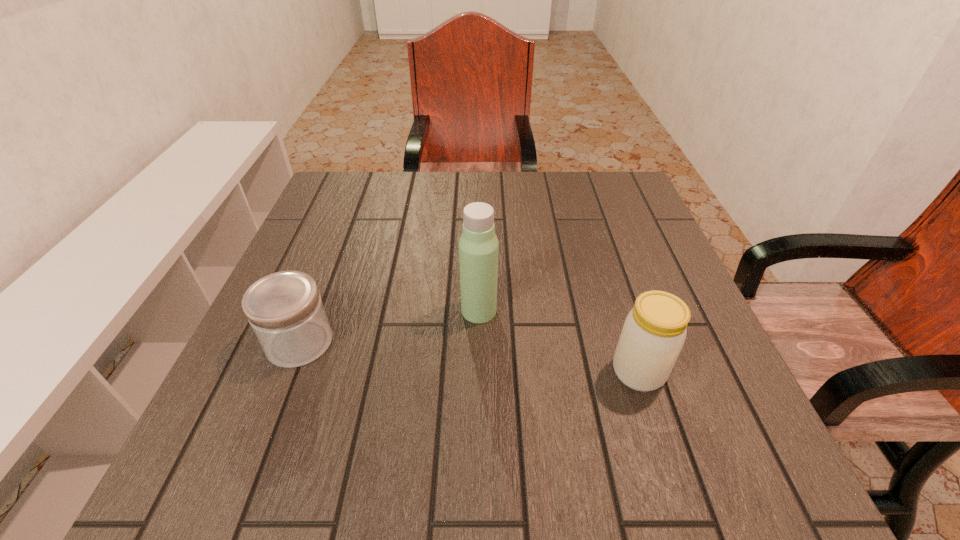
Where is `thermos bottle`? thermos bottle is located at coordinates (478, 246).

In order to click on the second object from left to right in this screenshot , I will do `click(478, 246)`.

Find the location of a particular element. the second shortest object is located at coordinates (654, 332).

Locate an element on the screen. Image resolution: width=960 pixels, height=540 pixels. the taller jar is located at coordinates (654, 332).

What are the coordinates of `the leftmost object` in the screenshot? It's located at (285, 311).

You are a GUI agent. You are given a task and a screenshot of the screen. Output one action in this format:
    pyautogui.click(x=<x>, y=<y>)
    Task: Click on the shorter jar
    The image size is (960, 540).
    Given the screenshot: What is the action you would take?
    [x=285, y=311]

The height and width of the screenshot is (540, 960). I want to click on free space located 0.350m on the left of the second object from right to left, so click(x=284, y=310).

The width and height of the screenshot is (960, 540). Find the location of `free location located 0.360m on the back of the taller jar`. free location located 0.360m on the back of the taller jar is located at coordinates (594, 233).

You are a GUI agent. You are given a task and a screenshot of the screen. Output one action in this format:
    pyautogui.click(x=<x>, y=<y>)
    Task: Click on the vacant space situated on the back of the leftmost object
    The image size is (960, 540).
    Given the screenshot: What is the action you would take?
    pyautogui.click(x=342, y=233)

Identify the location of object at the left edge. (285, 311).